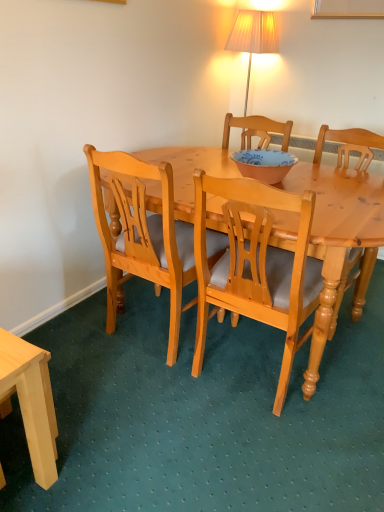
I want to click on free space behind light wood desk at lower left, so click(72, 385).